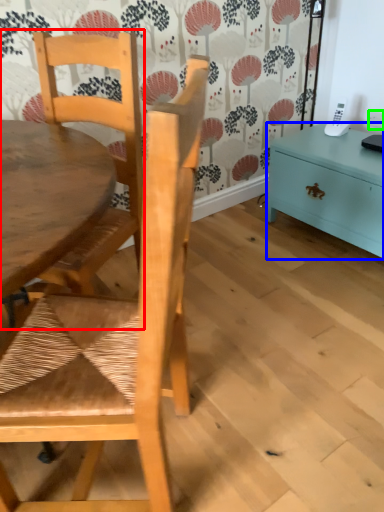
Question: Based on their relative distances, which object is farther from chair (highlighted by a red box)? Choose from nightstand (highlighted by a blue box) and power outlet (highlighted by a green box).

Choices:
 (A) nightstand
 (B) power outlet

Answer: (B)